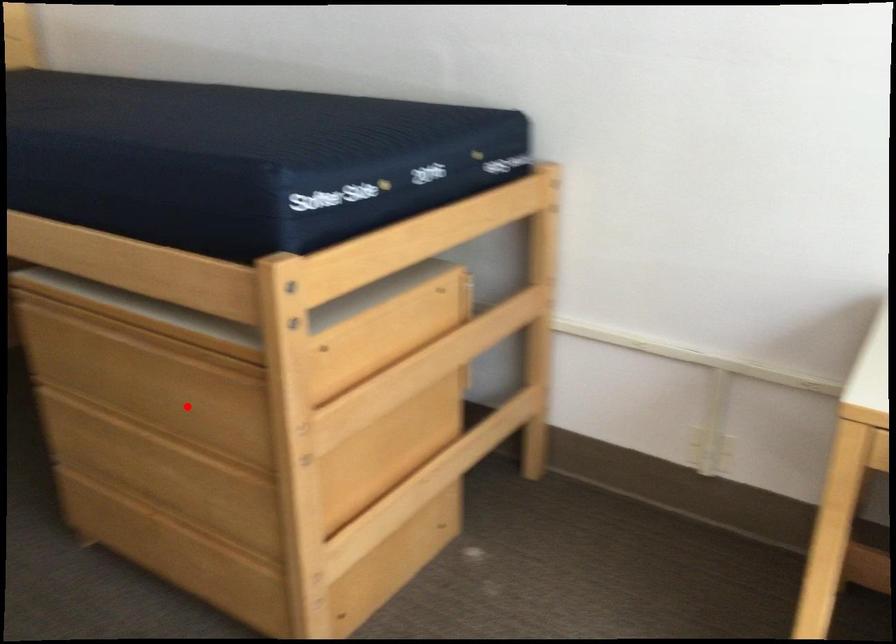
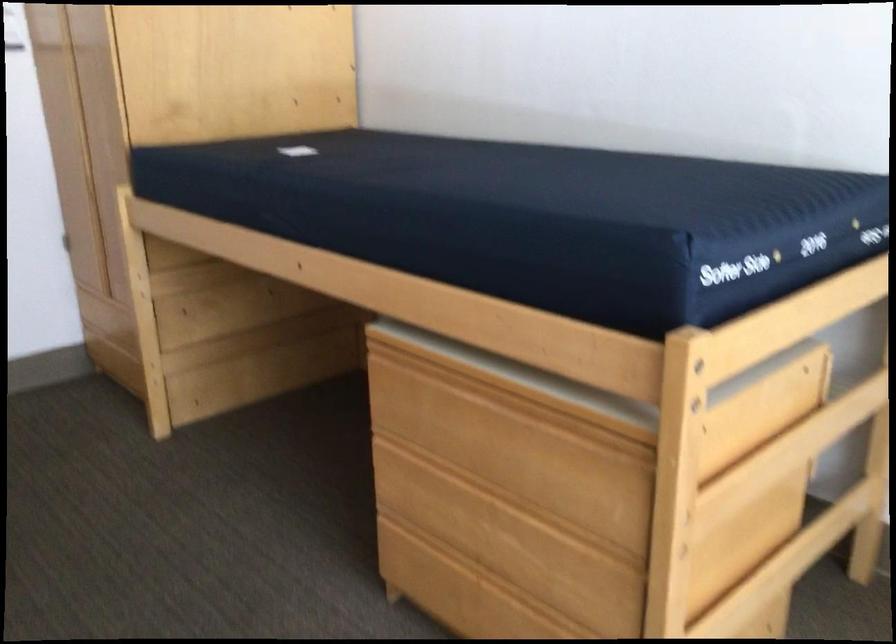
In the second image, find the point that corresponds to the highlighted location in the first image.

(540, 471)